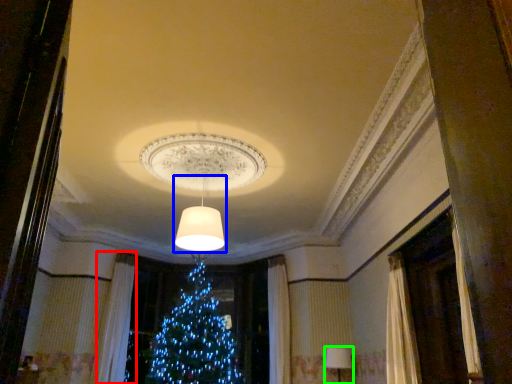
Question: Which object is the farthest from curtain (highlighted by a red box)? Choose among these: lamp (highlighted by a blue box) or lamp (highlighted by a green box).

Choices:
 (A) lamp
 (B) lamp

Answer: (B)